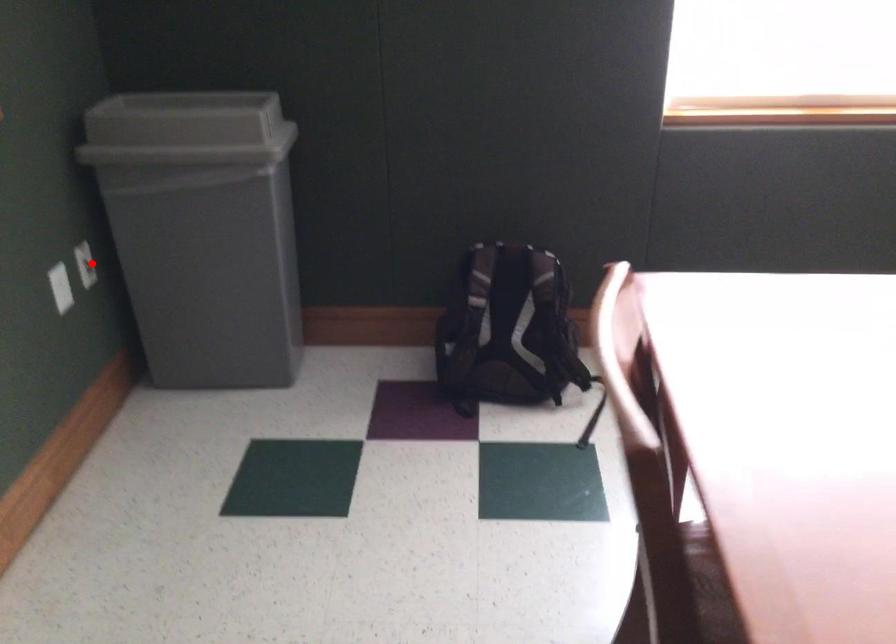
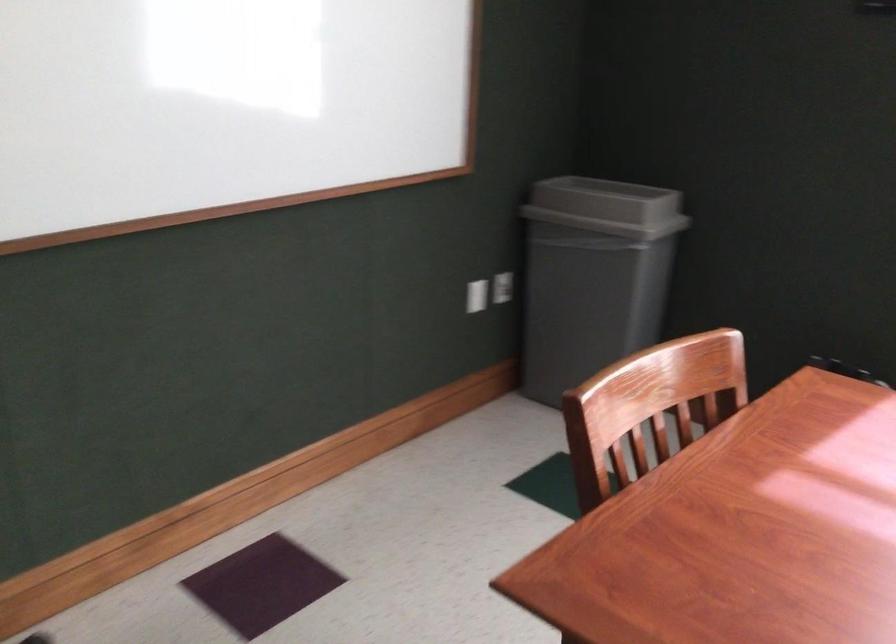
Question: A red point is marked in image1. In image2, is the corresponding 3D point closer to the camera or farther? Reply with the corresponding letter.

Choices:
 (A) The corresponding 3D point is closer.
 (B) The corresponding 3D point is farther.

Answer: (B)